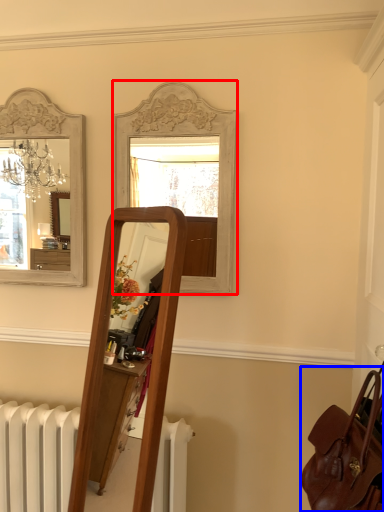
Question: Which object is closer to the camera taking this photo, mirror (highlighted by a red box) or bag (highlighted by a blue box)?

Choices:
 (A) mirror
 (B) bag

Answer: (B)